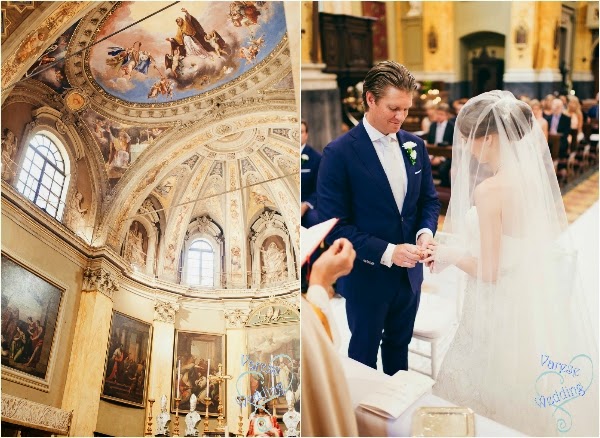
The width and height of the screenshot is (600, 438). What are the coordinates of `ceiling fresco painting` in the screenshot? It's located at (186, 34).